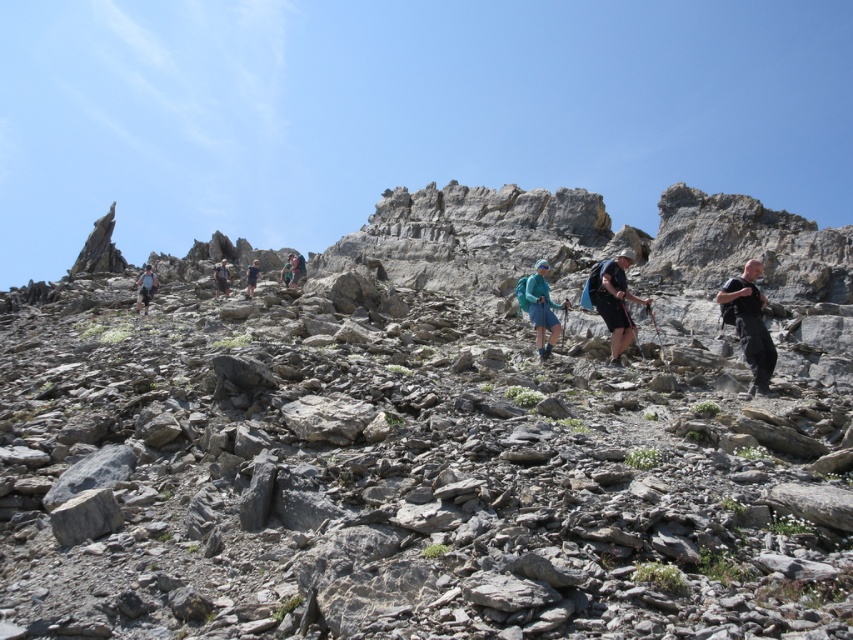
Does dark blue fabric backpack at center have a greater height compared to green fabric backpack at center?

Indeed, dark blue fabric backpack at center has a greater height compared to green fabric backpack at center.

Is dark blue fabric backpack at center shorter than green fabric backpack at center?

Incorrect, dark blue fabric backpack at center's height does not fall short of green fabric backpack at center's.

Where is `dark blue fabric backpack at center`? dark blue fabric backpack at center is located at coordinates (614, 300).

The height and width of the screenshot is (640, 853). In order to click on dark blue fabric backpack at center in this screenshot , I will do `click(614, 300)`.

Who is more forward, [524,291] or [302,276]?

Positioned in front is point [524,291].

Is teal fabric jacket at center below green fabric backpack at center?

Yes, teal fabric jacket at center is below green fabric backpack at center.

Does point (538, 259) come in front of point (302, 268)?

Yes, it is.

The width and height of the screenshot is (853, 640). Find the location of `teal fabric jacket at center`. teal fabric jacket at center is located at coordinates (541, 308).

Does black matte pants at right have a lesser height compared to dark blue fabric backpack at center?

Correct, black matte pants at right is not as tall as dark blue fabric backpack at center.

Which is more to the right, black matte pants at right or dark blue fabric backpack at center?

black matte pants at right is more to the right.

The width and height of the screenshot is (853, 640). Describe the element at coordinates (749, 323) in the screenshot. I see `black matte pants at right` at that location.

Where is `black matte pants at right`? black matte pants at right is located at coordinates (749, 323).